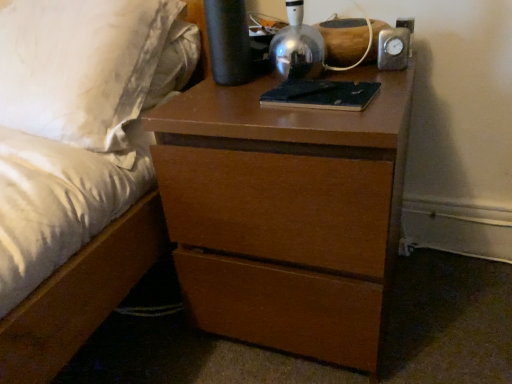
The image size is (512, 384). Find the location of `free spot in front of metallic dome at upper center`. free spot in front of metallic dome at upper center is located at coordinates (330, 99).